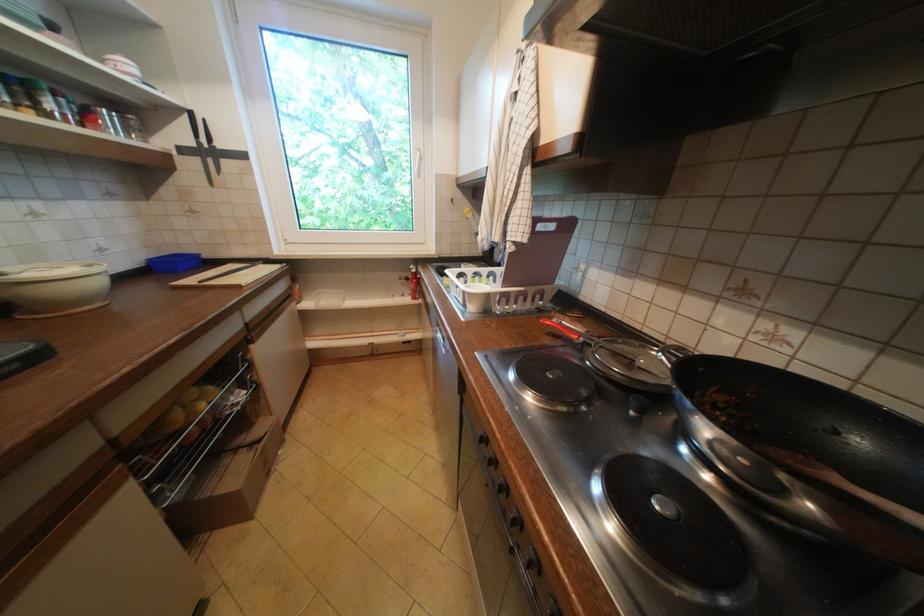
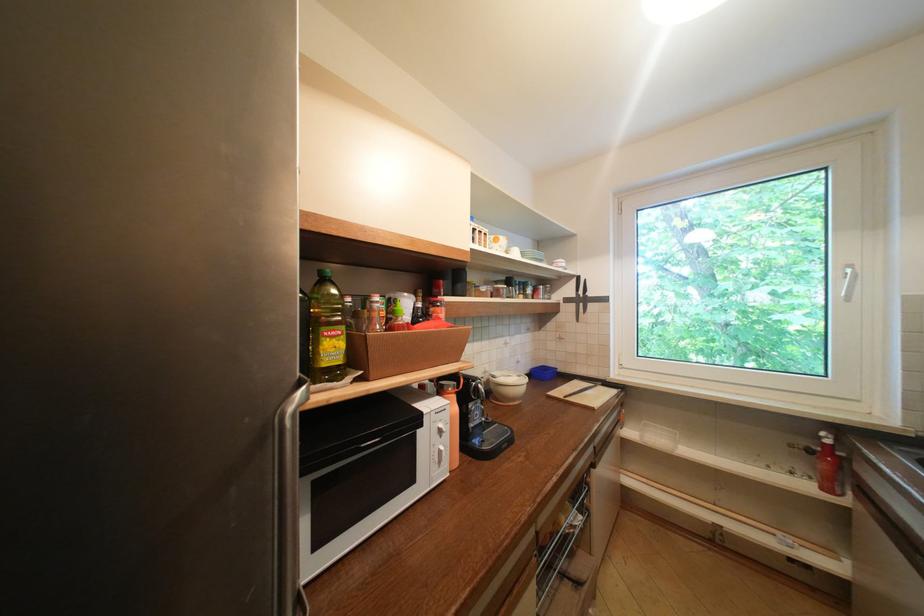
Locate, in the second image, the point that corresponds to (191,152) in the first image.

(575, 301)